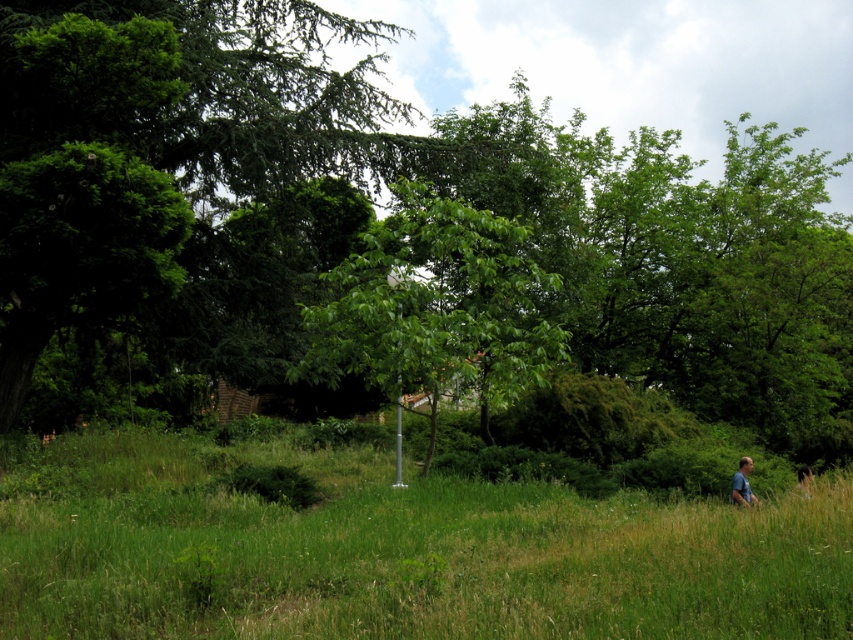
Which is above, green leafy tree at center or blue cotton shirt at lower right?

green leafy tree at center is above.

Does green leafy tree at center appear on the right side of blue cotton shirt at lower right?

Incorrect, green leafy tree at center is not on the right side of blue cotton shirt at lower right.

This screenshot has height=640, width=853. What are the coordinates of `green leafy tree at center` in the screenshot? It's located at (436, 307).

Identify the location of green leafy tree at center. This screenshot has height=640, width=853. (436, 307).

Is green grass at lower right wider than green leafy tree at center?

Indeed, green grass at lower right has a greater width compared to green leafy tree at center.

Is green grass at lower right to the right of green leafy tree at center from the viewer's perspective?

Indeed, green grass at lower right is positioned on the right side of green leafy tree at center.

Is point (601, 624) farther from camera compared to point (392, 376)?

No, (601, 624) is in front of (392, 376).

The height and width of the screenshot is (640, 853). In order to click on green grass at lower right in this screenshot , I will do `click(395, 550)`.

Does point (93, 600) come in front of point (740, 500)?

Yes.

Can you confirm if green grass at lower right is shorter than blue cotton shirt at lower right?

No.

Between point (39, 460) and point (743, 465), which one is positioned behind?

Point (39, 460)

I want to click on green grass at lower right, so click(395, 550).